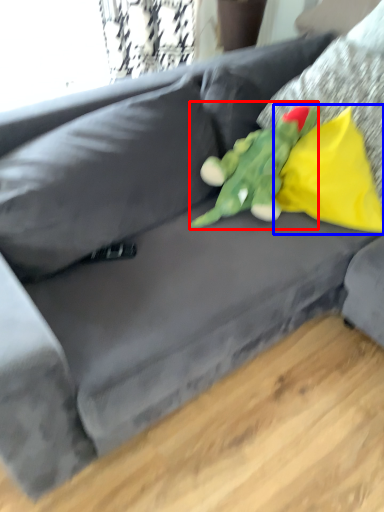
Question: Which point is further to the camera, toy (highlighted by a red box) or pillow (highlighted by a blue box)?

Choices:
 (A) toy
 (B) pillow

Answer: (B)